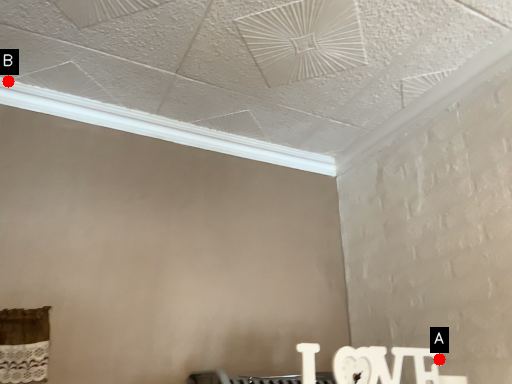
Question: Two points are circled on the image, labeled by A and B beside each circle. Among these points, which one is nearest to the camera?

Choices:
 (A) A is closer
 (B) B is closer

Answer: (A)